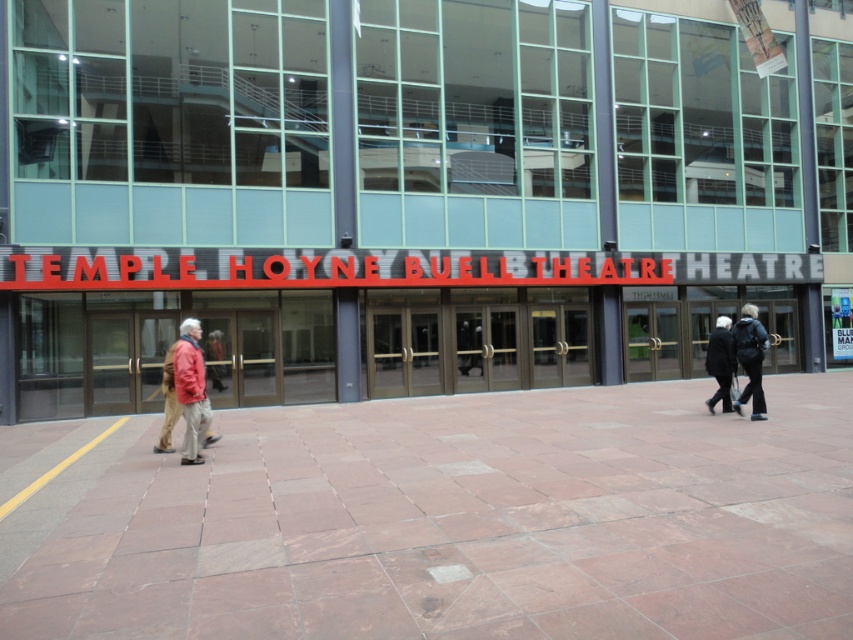
Question: Does brown stone pavement at center have a lesser width compared to red jacket at left?

Choices:
 (A) no
 (B) yes

Answer: (A)

Question: Estimate the real-world distances between objects in this image. Which object is farther from the red jacket at left?

Choices:
 (A) brown stone pavement at center
 (B) black leather jacket at center
 (C) black wool coat at center

Answer: (B)

Question: Does brown stone pavement at center lie behind red jacket at left?

Choices:
 (A) no
 (B) yes

Answer: (A)

Question: Among these points, which one is farthest from the camera?

Choices:
 (A) (753, 394)
 (B) (196, 333)
 (C) (717, 371)

Answer: (C)

Question: Which object is the closest to the red jacket at left?

Choices:
 (A) black leather jacket at center
 (B) black wool coat at center

Answer: (B)

Question: Can you confirm if brown stone pavement at center is wider than black wool coat at center?

Choices:
 (A) yes
 (B) no

Answer: (A)